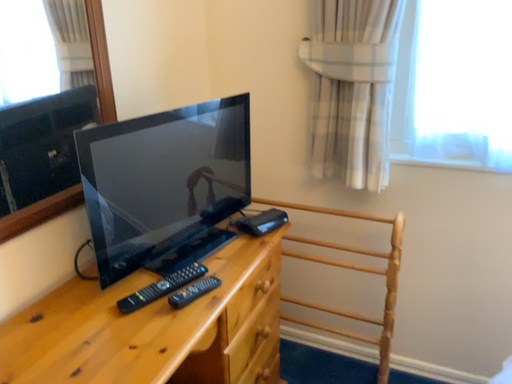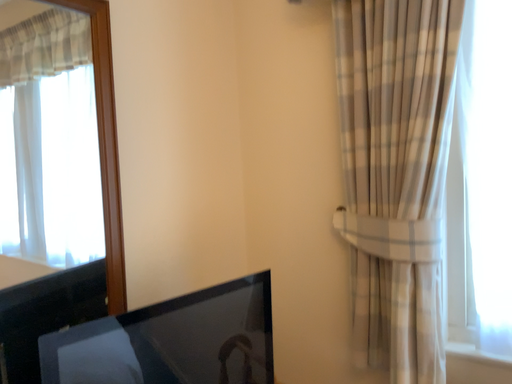
Question: Which way did the camera rotate in the video?

Choices:
 (A) rotated right
 (B) rotated left

Answer: (B)